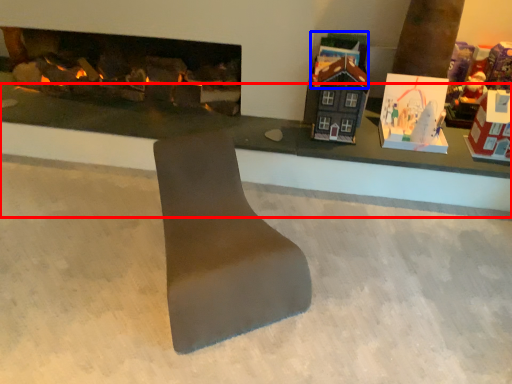
Question: Which point is closer to the camera, table (highlighted by a red box) or toy (highlighted by a blue box)?

Choices:
 (A) table
 (B) toy

Answer: (A)